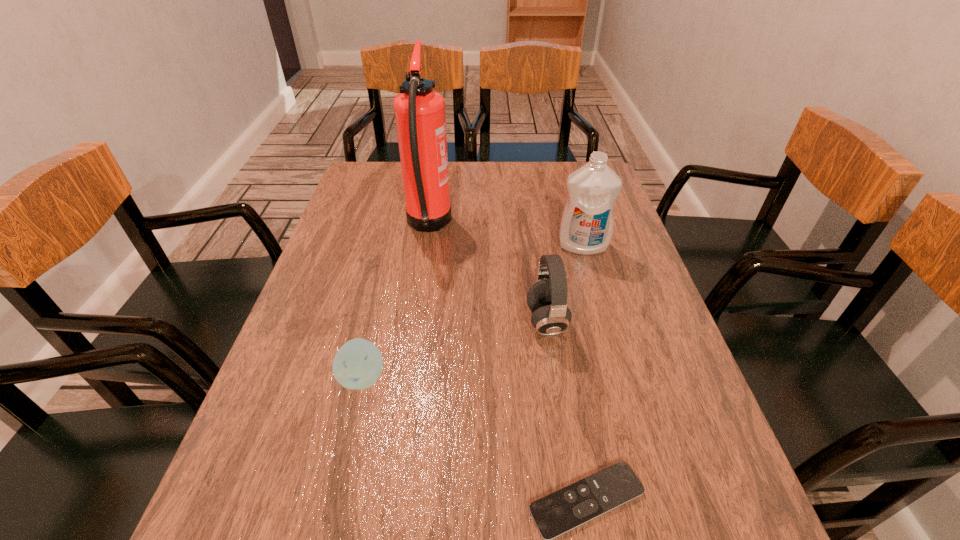
Image resolution: width=960 pixels, height=540 pixels. Identify the location of the tallest object. (419, 111).

Where is `detergent`? This screenshot has width=960, height=540. detergent is located at coordinates (586, 226).

The height and width of the screenshot is (540, 960). Find the location of `the third tallest object`. the third tallest object is located at coordinates (547, 298).

You are a GUI agent. You are given a task and a screenshot of the screen. Output one action in this format:
    pyautogui.click(x=<x>, y=<y>)
    Task: Click on the third farthest object
    This screenshot has height=540, width=960.
    Given the screenshot: What is the action you would take?
    pyautogui.click(x=547, y=298)

Identify the location of the fourth farthest object. (358, 364).

Where is `apple`? apple is located at coordinates (358, 364).

At what (x,y) coordinates should I click in order to perform the action: click on blank space located 0.080m at the nozzle of the tallest object. Please return your answer as a coordinate pair (x, y). This screenshot has height=540, width=960. Looking at the image, I should click on coord(479,226).

Find the location of a particular element. This screenshot has width=960, height=540. free space located on the front of the detergent is located at coordinates (592, 282).

Find the location of a particular element. The height and width of the screenshot is (540, 960). vacant space located on the ear cups of the headset is located at coordinates (495, 322).

Find the location of a particular element. vacant region located 0.270m on the ear cups of the headset is located at coordinates (408, 322).